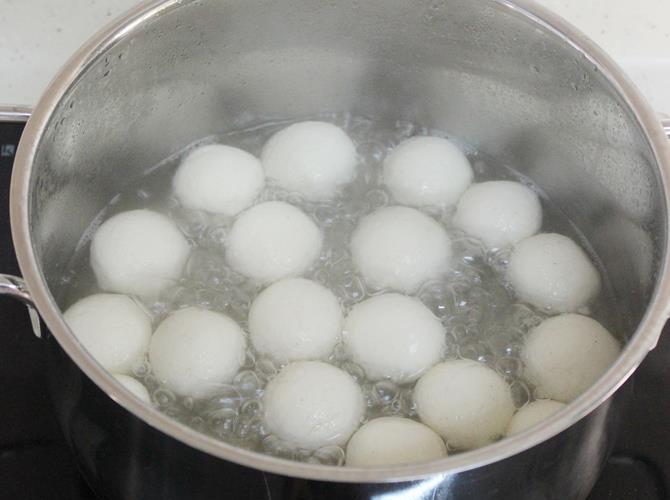
I want to click on top of stove, so click(x=3, y=190).